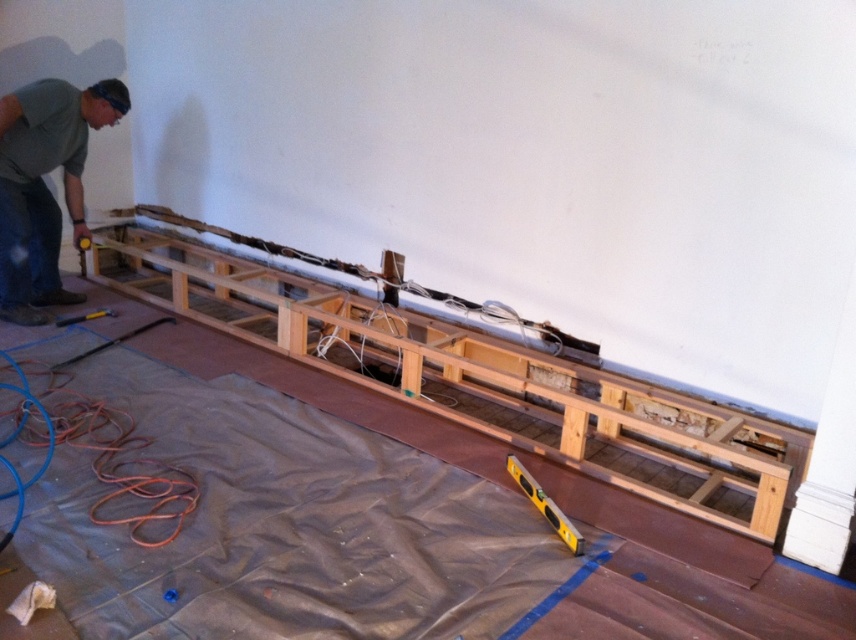
Question: Which of these objects is positioned closest to the yellow plastic level at center?

Choices:
 (A) green matte shirt at left
 (B) yellow metallic level at lower center
 (C) metallic silver hammer at lower left

Answer: (C)

Question: Which object appears closest to the camera in this image?

Choices:
 (A) yellow plastic level at center
 (B) green matte shirt at left
 (C) metallic silver hammer at lower left

Answer: (A)

Question: Can you confirm if green matte shirt at left is thinner than yellow plastic level at center?

Choices:
 (A) yes
 (B) no

Answer: (B)

Question: Considering the relative positions of metallic silver hammer at lower left and yellow metallic level at lower center in the image provided, where is metallic silver hammer at lower left located with respect to yellow metallic level at lower center?

Choices:
 (A) above
 (B) below

Answer: (B)

Question: Which object is positioned farthest from the green matte shirt at left?

Choices:
 (A) metallic silver hammer at lower left
 (B) yellow plastic level at center
 (C) yellow metallic level at lower center
 (D) natural wood frame at center

Answer: (B)

Question: Is natural wood frame at center below metallic silver hammer at lower left?

Choices:
 (A) yes
 (B) no

Answer: (B)